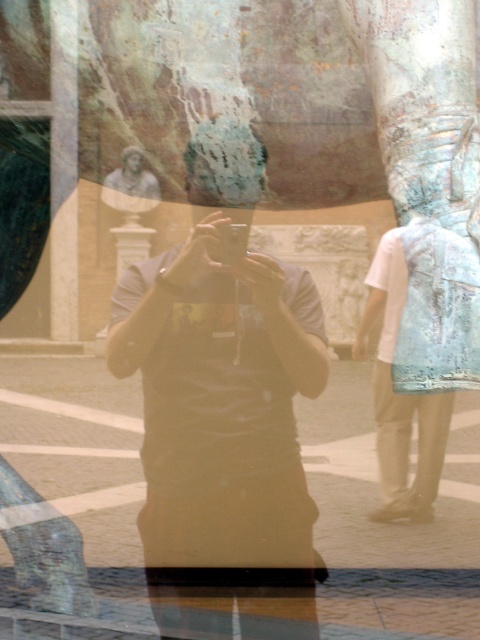
You are standing in front of a reflective surface and see two points marked in the image. The first point is at coordinate (300, 538) and the second is at (393, 301). Which point is nearer to you?

Point (300, 538) is closer to the viewer than point (393, 301).